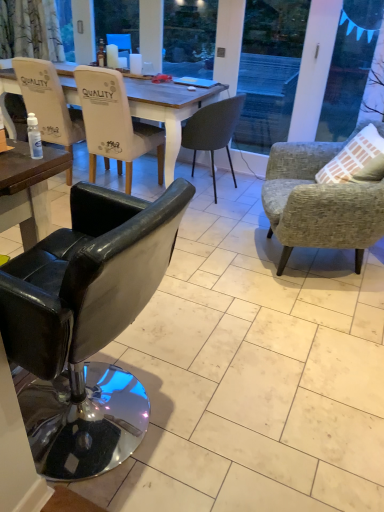
Locate an element on the screen. The height and width of the screenshot is (512, 384). free space in front of transparent plastic bottle at lower left is located at coordinates (21, 169).